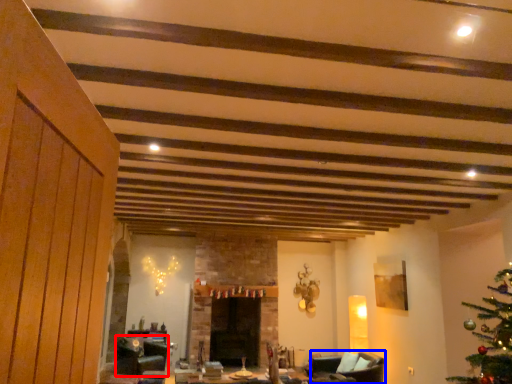
Question: Which object appears closest to the camera in this image, swivel chair (highlighted by a red box) or armchair (highlighted by a blue box)?

Choices:
 (A) swivel chair
 (B) armchair

Answer: (B)